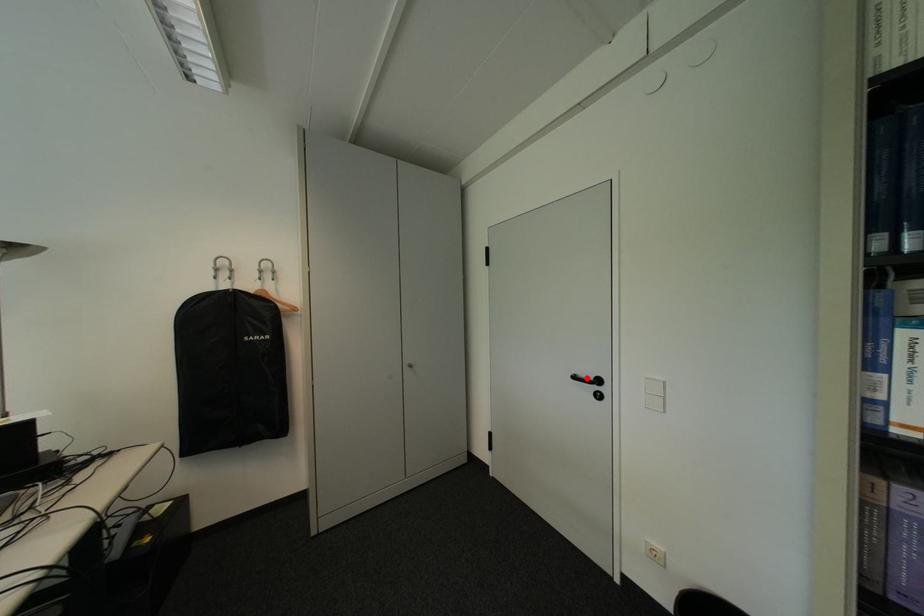
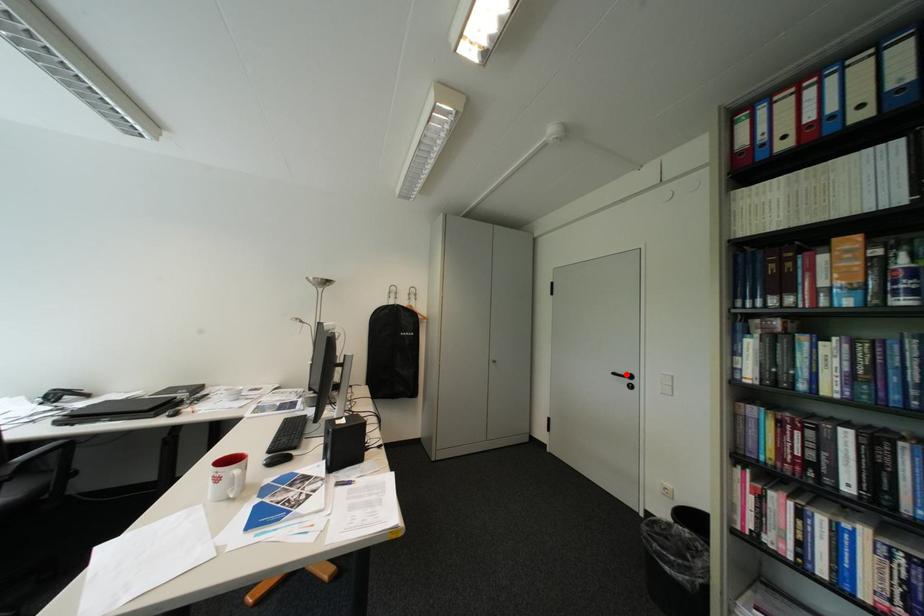
I am providing you with two images of the same scene from different viewpoints. A red point is marked on the first image and another point is marked on the second image. Does the point marked in image1 correspond to the same location as the one in image2?

Yes